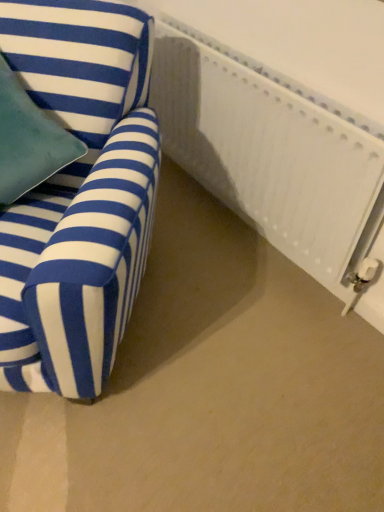
Question: Is point (119, 116) closer or farther from the camera than point (218, 60)?

Choices:
 (A) closer
 (B) farther

Answer: (A)

Question: Is blue striped fabric chair at left wider or thinner than white textured radiator at right?

Choices:
 (A) thin
 (B) wide

Answer: (B)

Question: In the image, is blue striped fabric chair at left on the left side or the right side of white textured radiator at right?

Choices:
 (A) right
 (B) left

Answer: (B)

Question: In terms of height, does white textured radiator at right look taller or shorter compared to blue striped fabric chair at left?

Choices:
 (A) short
 (B) tall

Answer: (A)

Question: From the image's perspective, relative to blue striped fabric chair at left, is white textured radiator at right above or below?

Choices:
 (A) above
 (B) below

Answer: (A)

Question: Is white textured radiator at right bigger or smaller than blue striped fabric chair at left?

Choices:
 (A) small
 (B) big

Answer: (A)

Question: From a real-world perspective, relative to blue striped fabric chair at left, is white textured radiator at right vertically above or below?

Choices:
 (A) below
 (B) above

Answer: (A)